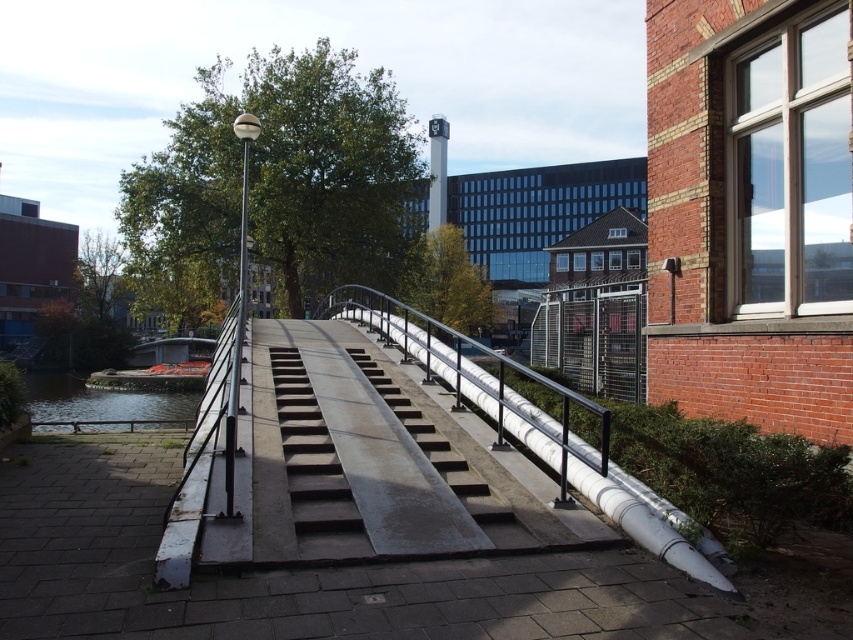
From the picture: You are a delivery person carrying a large box and need to cross the pedestrian bridge. The stairs might be too narrow for your box. Which object on the bridge is wider, the concrete stairs at center or the greenish water at lower left?

The greenish water at lower left is wider than the concrete stairs at center, so the stairs are narrower. Therefore, the greenish water at lower left is wider.

You are a delivery person carrying a heavy box and need to cross the bridge. The concrete stairs at center and greenish water at lower left are in your path. Which one should you avoid stepping on to safely reach the other side?

You should avoid stepping on the greenish water at lower left because the concrete stairs at center is positioned over it, so the stairs are the safe path.

You are a photographer standing on the metallic gray bridge at center and want to capture the greenish water at lower left in your shot. Since the bridge is in front of the water, will the water be fully visible in your photo?

The metallic gray bridge at center is in front of the greenish water at lower left, so the water might be partially or fully blocked depending on the camera angle. To ensure full visibility, adjust your position or angle to avoid the bridge obstructing the view.